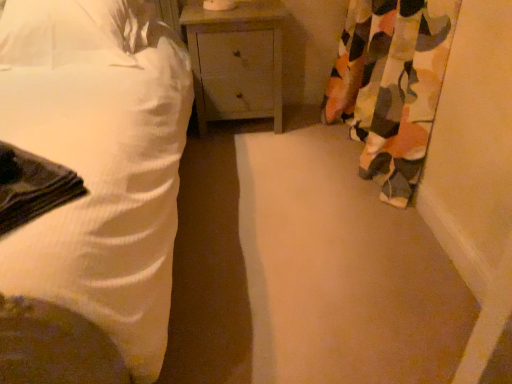
Question: Is white textured bed at left next to matte gray nightstand at center and touching it?

Choices:
 (A) yes
 (B) no

Answer: (B)

Question: From the image's perspective, is white textured bed at left located beneath matte gray nightstand at center?

Choices:
 (A) no
 (B) yes

Answer: (B)

Question: Is white textured bed at left bigger than matte gray nightstand at center?

Choices:
 (A) yes
 (B) no

Answer: (A)

Question: Does white textured bed at left have a lesser height compared to matte gray nightstand at center?

Choices:
 (A) yes
 (B) no

Answer: (B)

Question: Does white textured bed at left contain matte gray nightstand at center?

Choices:
 (A) yes
 (B) no

Answer: (B)

Question: Is white fabric pillow at upper left wider or thinner than matte gray nightstand at center?

Choices:
 (A) thin
 (B) wide

Answer: (B)

Question: Considering the positions of point (64, 11) and point (269, 34), is point (64, 11) closer or farther from the camera than point (269, 34)?

Choices:
 (A) closer
 (B) farther

Answer: (A)

Question: From the image's perspective, is white fabric pillow at upper left located above or below matte gray nightstand at center?

Choices:
 (A) below
 (B) above

Answer: (B)

Question: Is white fabric pillow at upper left inside or outside of matte gray nightstand at center?

Choices:
 (A) outside
 (B) inside

Answer: (A)

Question: From the image's perspective, is matte gray nightstand at center above or below white textured bed at left?

Choices:
 (A) above
 (B) below

Answer: (A)

Question: Considering the positions of matte gray nightstand at center and white textured bed at left in the image, is matte gray nightstand at center taller or shorter than white textured bed at left?

Choices:
 (A) tall
 (B) short

Answer: (B)

Question: In terms of size, does matte gray nightstand at center appear bigger or smaller than white textured bed at left?

Choices:
 (A) big
 (B) small

Answer: (B)

Question: Considering the positions of point (257, 71) and point (158, 177), is point (257, 71) closer or farther from the camera than point (158, 177)?

Choices:
 (A) farther
 (B) closer

Answer: (A)

Question: Does point (105, 253) appear closer or farther from the camera than point (411, 52)?

Choices:
 (A) farther
 (B) closer

Answer: (B)

Question: From their relative heights in the image, would you say white textured bed at left is taller or shorter than camouflage fabric curtain at right?

Choices:
 (A) tall
 (B) short

Answer: (A)